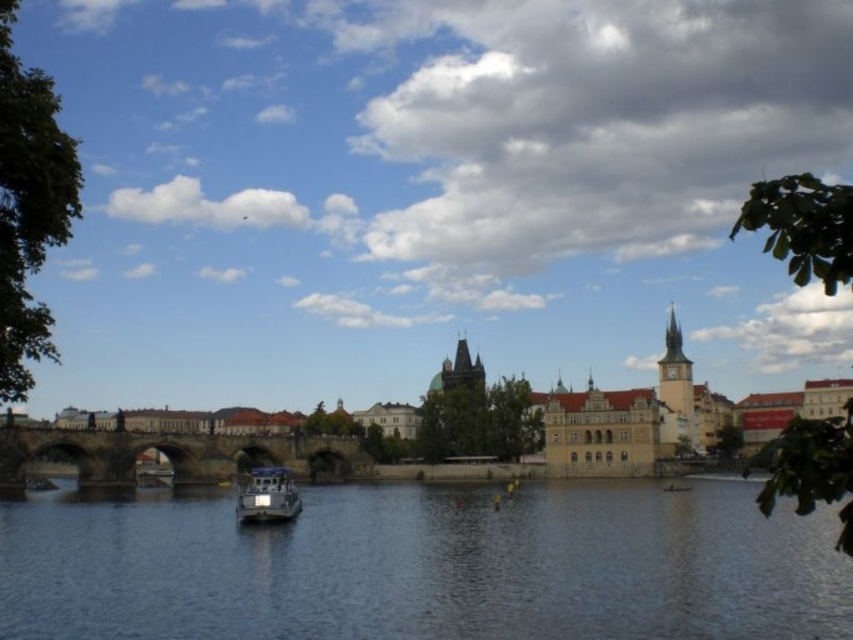
Question: Does dark blue water at center have a smaller size compared to metallic gray boat at center?

Choices:
 (A) no
 (B) yes

Answer: (A)

Question: Which of these objects is positioned farthest from the dark blue water at center?

Choices:
 (A) metallic gray boat at center
 (B) brown stone bridge at center

Answer: (B)

Question: Which object is the closest to the dark blue water at center?

Choices:
 (A) metallic gray boat at center
 (B) brown stone bridge at center

Answer: (A)

Question: Among these objects, which one is farthest from the camera?

Choices:
 (A) metallic gray boat at center
 (B) dark blue water at center

Answer: (A)

Question: Does brown stone bridge at center have a larger size compared to metallic gray boat at center?

Choices:
 (A) no
 (B) yes

Answer: (B)

Question: In this image, where is brown stone bridge at center located relative to metallic gray boat at center?

Choices:
 (A) below
 (B) above

Answer: (B)